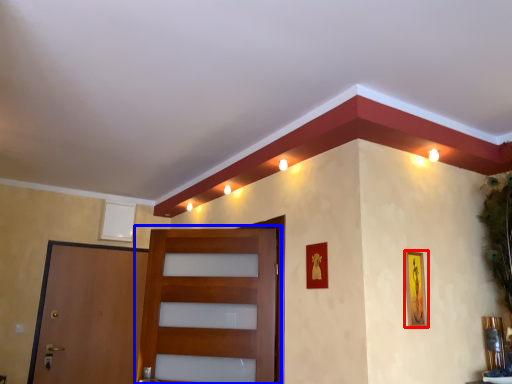
Question: Which object is further to the camera taking this photo, picture frame (highlighted by a red box) or door (highlighted by a blue box)?

Choices:
 (A) picture frame
 (B) door

Answer: (B)